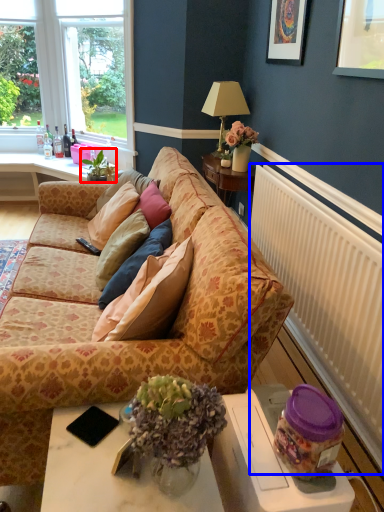
Question: Which object is further to the camera taking this photo, houseplant (highlighted by a red box) or radiator (highlighted by a blue box)?

Choices:
 (A) houseplant
 (B) radiator

Answer: (A)